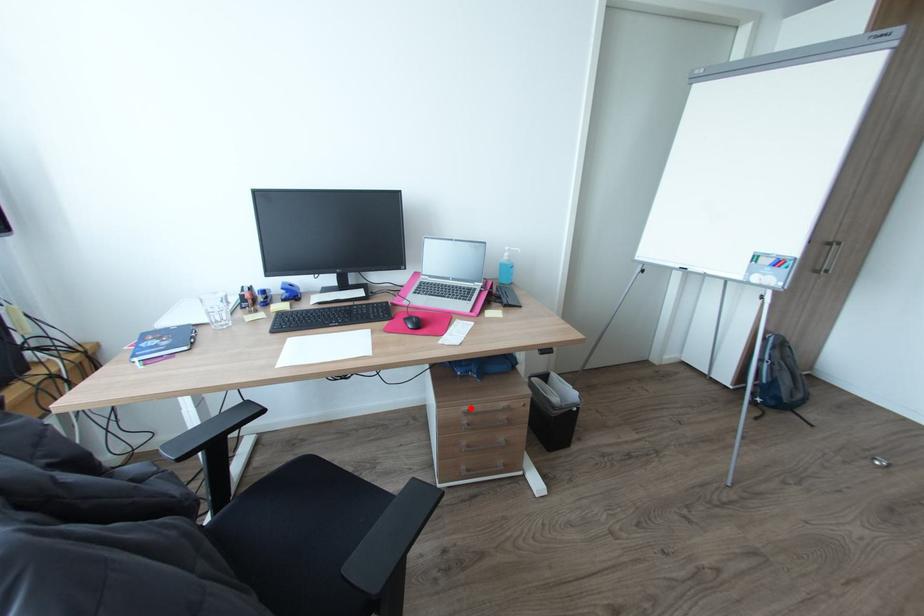
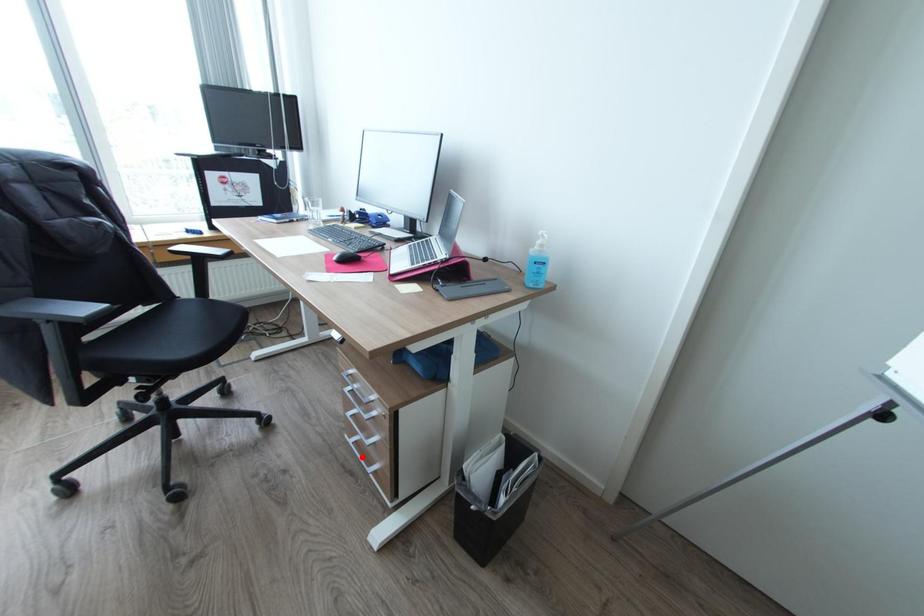
I am providing you with two images of the same scene from different viewpoints. A red point is marked on the first image and another point is marked on the second image. Do the highlighted points in image1 and image2 indicate the same real-world spot?

No